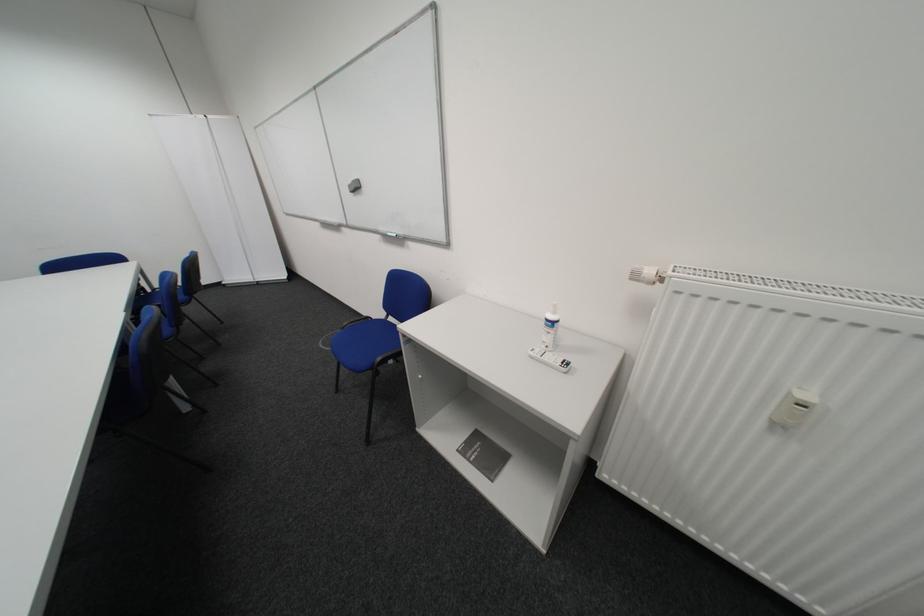
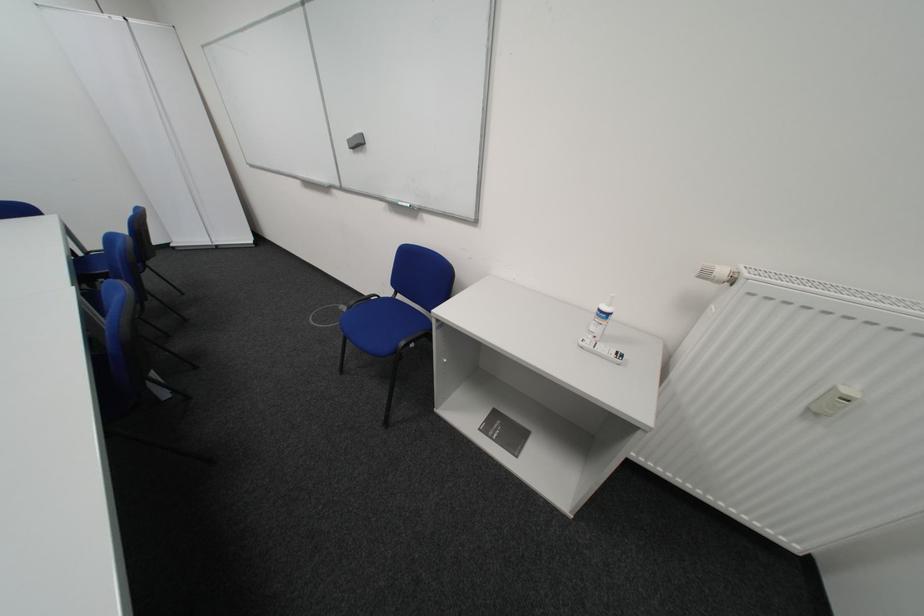
In the second image, find the point that corresponds to pixel 480 461 in the first image.

(504, 439)